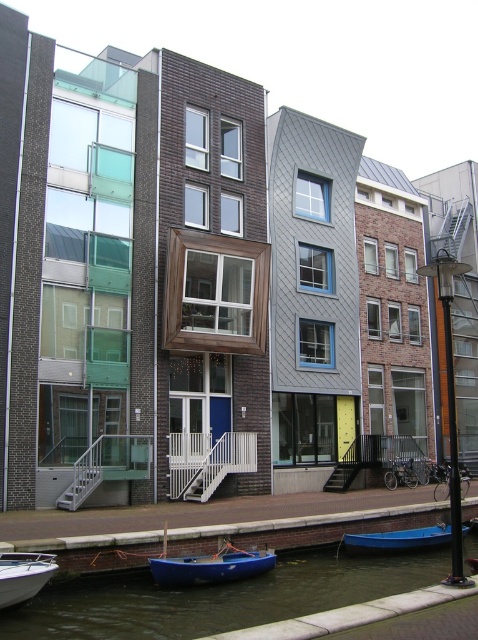
Question: Does blue matte boat at lower center have a lesser width compared to blue plastic boat at lower center?

Choices:
 (A) yes
 (B) no

Answer: (A)

Question: Estimate the real-world distances between objects in this image. Which object is farther from the blue plastic boat at lower center?

Choices:
 (A) dark blue water at lower center
 (B) white fiberglass boat at lower left
 (C) blue matte boat at lower center

Answer: (B)

Question: Can you confirm if blue matte boat at lower center is wider than blue plastic boat at lower center?

Choices:
 (A) no
 (B) yes

Answer: (A)

Question: Which object is the closest to the blue matte boat at lower center?

Choices:
 (A) white fiberglass boat at lower left
 (B) blue plastic boat at lower center
 (C) dark blue water at lower center

Answer: (C)

Question: Which object appears closest to the camera in this image?

Choices:
 (A) dark blue water at lower center
 (B) blue matte boat at lower center
 (C) blue plastic boat at lower center
 (D) white fiberglass boat at lower left

Answer: (D)

Question: From the image, what is the correct spatial relationship of blue matte boat at lower center in relation to blue plastic boat at lower center?

Choices:
 (A) right
 (B) left

Answer: (B)